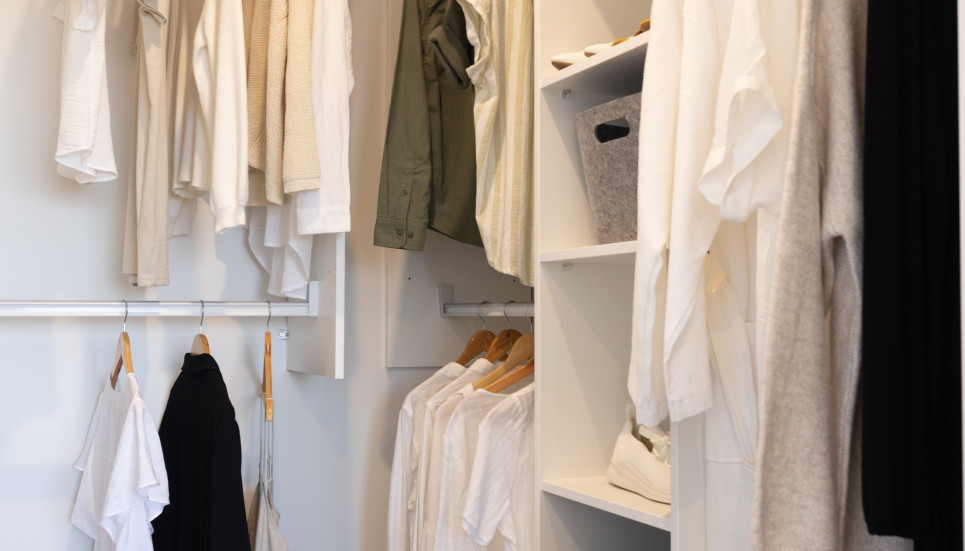
Locate an element on the screen. hangers is located at coordinates (278, 367), (205, 343), (128, 350), (471, 345), (505, 334), (515, 352), (519, 372).